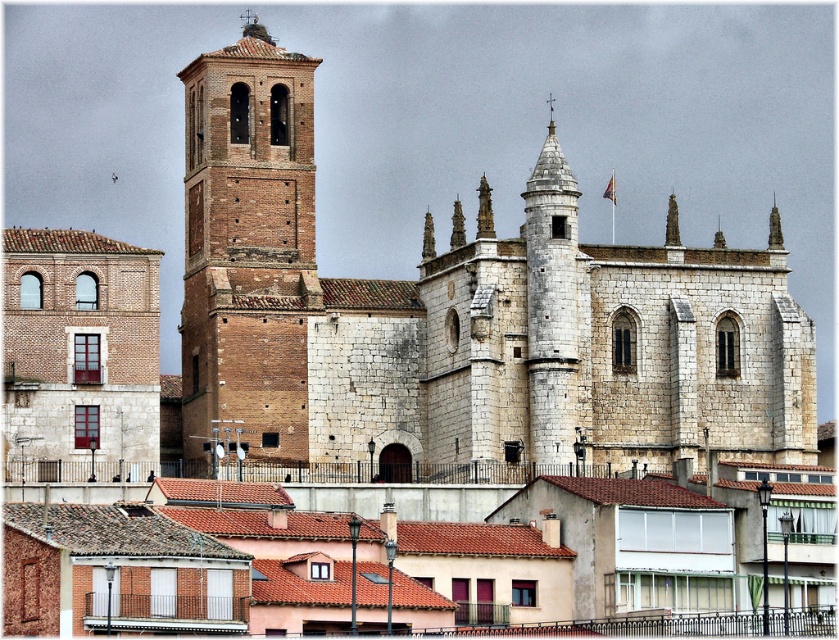
Between brick tower at upper left and brick tower at left, which one is positioned lower?

Positioned lower is brick tower at upper left.

Based on the photo, how distant is brick tower at upper left from brick tower at left?

5.58 meters

Is point (670, 241) positioned in front of point (194, 292)?

Yes, point (670, 241) is in front of point (194, 292).

Locate an element on the screen. The width and height of the screenshot is (839, 640). brick tower at upper left is located at coordinates (462, 316).